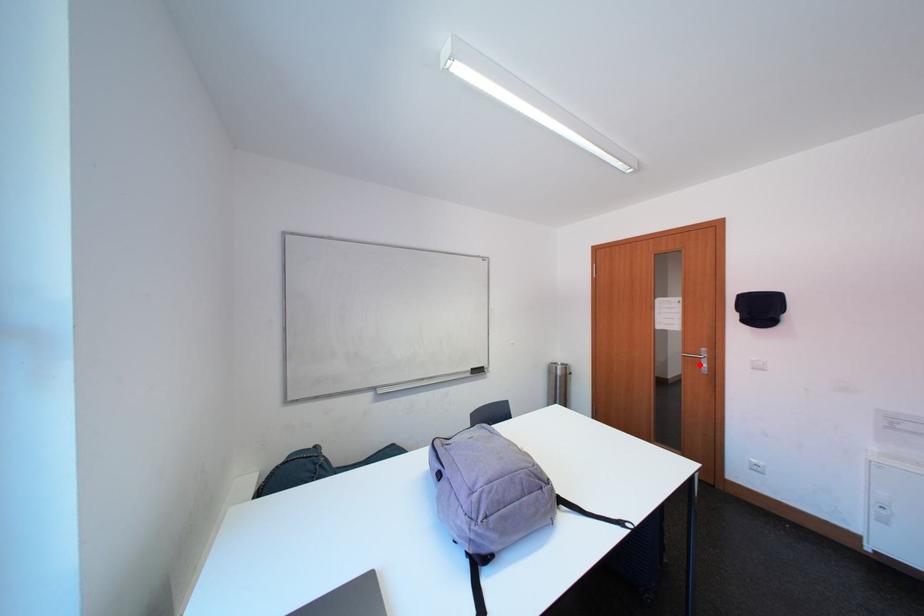
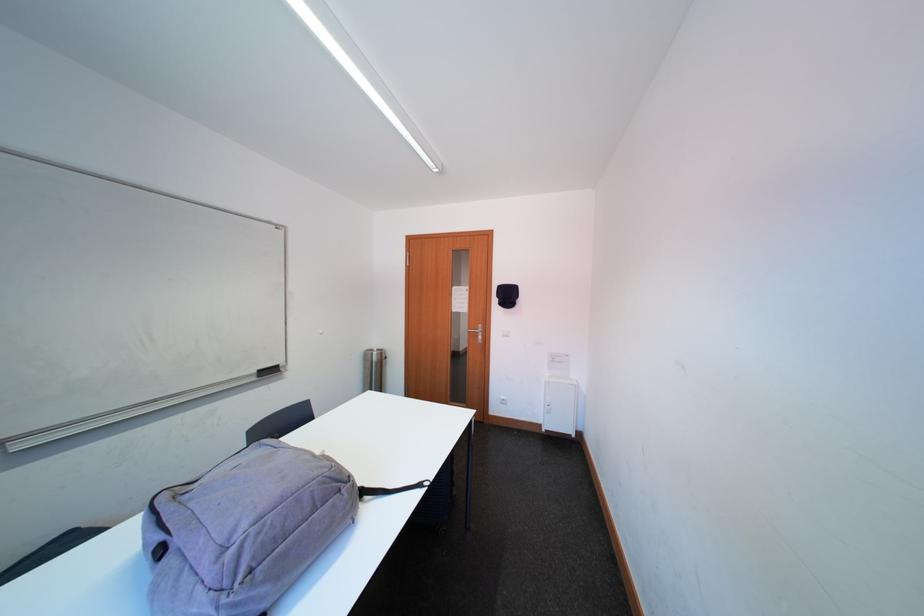
Locate, in the second image, the point that corresponds to the highlighted location in the first image.

(481, 339)